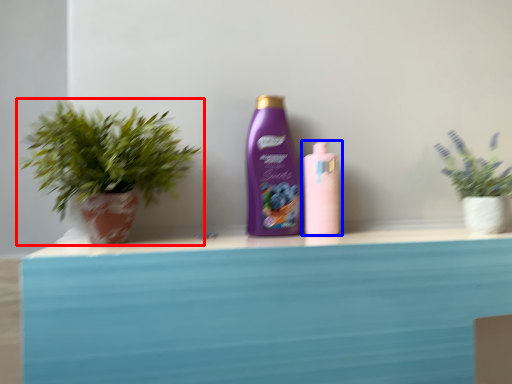
Question: Which object appears farthest to the camera in this image, houseplant (highlighted by a red box) or bottle (highlighted by a blue box)?

Choices:
 (A) houseplant
 (B) bottle

Answer: (B)